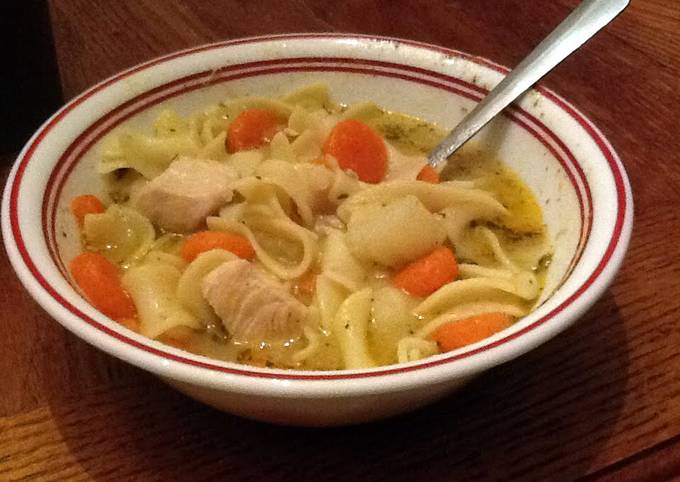
Locate an element on the screen. The width and height of the screenshot is (680, 482). shadow on table, under bowl is located at coordinates (566, 403), (122, 424), (284, 460).